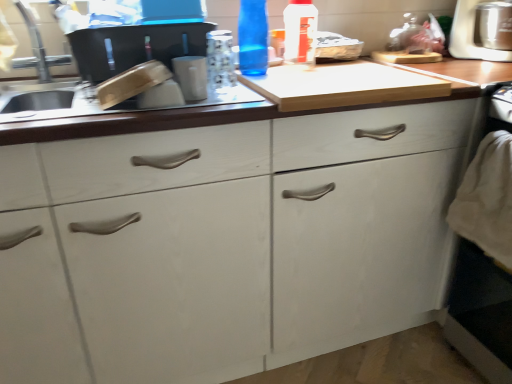
What is the approximate height of stainless steel food processor at upper right?

It is 8.36 inches.

The image size is (512, 384). What are the coordinates of `white matte cabinet at center` in the screenshot? It's located at (x=224, y=244).

Where is `brushed metal faucet at upper left`? The image size is (512, 384). brushed metal faucet at upper left is located at coordinates (37, 48).

From a real-world perspective, which object rests below the other?

white matte cabinet at center, from a real-world perspective.

Relative to blue glass bottle at upper center, arranged as the second bottle when viewed from the right, is white matte cabinet at center in front or behind?

Clearly, white matte cabinet at center is in front of blue glass bottle at upper center, arranged as the second bottle when viewed from the right.

Based on their positions, is white matte cabinet at center located to the left or right of blue glass bottle at upper center, the 1th bottle when ordered from left to right?

white matte cabinet at center is to the right of blue glass bottle at upper center, the 1th bottle when ordered from left to right.

Locate an element on the screen. bottle that is on the left side of white matte cabinet at center is located at coordinates (253, 37).

Is transparent plastic bottle at upper center, which is counted as the 2th bottle, starting from the left, taller or shorter than brushed metal faucet at upper left?

In the image, transparent plastic bottle at upper center, which is counted as the 2th bottle, starting from the left, appears to be shorter than brushed metal faucet at upper left.

Visually, is transparent plastic bottle at upper center, which is counted as the 2th bottle, starting from the left, positioned to the left or to the right of brushed metal faucet at upper left?

Based on their positions, transparent plastic bottle at upper center, which is counted as the 2th bottle, starting from the left, is located to the right of brushed metal faucet at upper left.

From a real-world perspective, which object rests below the other?

brushed metal faucet at upper left is physically lower.

Is transparent plastic bottle at upper center, which is counted as the 2th bottle, starting from the left, further to camera compared to brushed metal faucet at upper left?

Yes, transparent plastic bottle at upper center, which is counted as the 2th bottle, starting from the left, is behind brushed metal faucet at upper left.

Would you say blue glass bottle at upper center, arranged as the second bottle when viewed from the right, is outside white matte cabinet at center?

Yes, blue glass bottle at upper center, arranged as the second bottle when viewed from the right, is outside of white matte cabinet at center.

From the picture: Does blue glass bottle at upper center, the 1th bottle when ordered from left to right, lie behind white matte cabinet at center?

Yes, it is behind white matte cabinet at center.

From the image's perspective, is blue glass bottle at upper center, arranged as the second bottle when viewed from the right, located above or below white matte cabinet at center?

From the image's perspective, blue glass bottle at upper center, arranged as the second bottle when viewed from the right, appears above white matte cabinet at center.

Can you confirm if blue glass bottle at upper center, arranged as the second bottle when viewed from the right, is smaller than white matte cabinet at center?

Yes.

Is white matte cabinet at center shorter than transparent plastic bottle at upper center, marked as the 1th bottle in a right-to-left arrangement?

Incorrect, the height of white matte cabinet at center does not fall short of that of transparent plastic bottle at upper center, marked as the 1th bottle in a right-to-left arrangement.

From the picture: Would you say white matte cabinet at center is a long distance from transparent plastic bottle at upper center, marked as the 1th bottle in a right-to-left arrangement?

white matte cabinet at center is actually quite close to transparent plastic bottle at upper center, marked as the 1th bottle in a right-to-left arrangement.

In terms of size, does white matte cabinet at center appear bigger or smaller than transparent plastic bottle at upper center, which is counted as the 2th bottle, starting from the left?

In the image, white matte cabinet at center appears to be larger than transparent plastic bottle at upper center, which is counted as the 2th bottle, starting from the left.

From a real-world perspective, which is physically above, white matte cabinet at center or transparent plastic bottle at upper center, which is counted as the 2th bottle, starting from the left?

From a 3D spatial view, transparent plastic bottle at upper center, which is counted as the 2th bottle, starting from the left, is above.

Would you say brushed metal faucet at upper left is outside white matte cabinet at center?

Yes.

In the scene shown: Can you confirm if brushed metal faucet at upper left is taller than white matte cabinet at center?

No, brushed metal faucet at upper left is not taller than white matte cabinet at center.

From a real-world perspective, which is physically above, brushed metal faucet at upper left or white matte cabinet at center?

brushed metal faucet at upper left, from a real-world perspective.

Identify the location of faucet located on the left of white matte cabinet at center. (37, 48).

What's the angular difference between stainless steel food processor at upper right and brushed metal faucet at upper left's facing directions?

The angle between the facing direction of stainless steel food processor at upper right and the facing direction of brushed metal faucet at upper left is 4.9e-05 degrees.

From a real-world perspective, is stainless steel food processor at upper right positioned above or below brushed metal faucet at upper left?

stainless steel food processor at upper right is below brushed metal faucet at upper left.

At what (x,y) coordinates should I click in order to perform the action: click on appliance lying behind the brushed metal faucet at upper left. Please return your answer as a coordinate pair (x, y). Looking at the image, I should click on (470, 36).

Does stainless steel food processor at upper right contain brushed metal faucet at upper left?

No, stainless steel food processor at upper right does not contain brushed metal faucet at upper left.

Based on their positions, is white matte cabinet at center located to the left or right of brushed metal faucet at upper left?

In the image, white matte cabinet at center appears on the right side of brushed metal faucet at upper left.

Which object is more forward, white matte cabinet at center or brushed metal faucet at upper left?

white matte cabinet at center is closer to the camera.

Does white matte cabinet at center have a lesser height compared to brushed metal faucet at upper left?

No.

Which object is wider, white matte cabinet at center or brushed metal faucet at upper left?

white matte cabinet at center is wider.

You are a GUI agent. You are given a task and a screenshot of the screen. Output one action in this format:
    pyautogui.click(x=<x>, y=<y>)
    Task: Click on the 1st bottle behind the white matte cabinet at center, counting from the anchor's position
    This screenshot has height=384, width=512.
    Given the screenshot: What is the action you would take?
    pyautogui.click(x=253, y=37)

Where is `faucet on the left of transparent plastic bottle at upper center, which is counted as the 2th bottle, starting from the left`? faucet on the left of transparent plastic bottle at upper center, which is counted as the 2th bottle, starting from the left is located at coordinates (37, 48).

Considering their positions, is brushed metal faucet at upper left positioned closer to white matte cabinet at center than blue glass bottle at upper center, the 1th bottle when ordered from left to right?

blue glass bottle at upper center, the 1th bottle when ordered from left to right, is positioned closer to the anchor white matte cabinet at center.

From the image, which object appears to be nearer to stainless steel food processor at upper right, transparent plastic bottle at upper center, which is counted as the 2th bottle, starting from the left, or brushed metal faucet at upper left?

The object closer to stainless steel food processor at upper right is transparent plastic bottle at upper center, which is counted as the 2th bottle, starting from the left.

From the image, which object appears to be farther from blue glass bottle at upper center, arranged as the second bottle when viewed from the right, white matte cabinet at center or stainless steel food processor at upper right?

stainless steel food processor at upper right lies further to blue glass bottle at upper center, arranged as the second bottle when viewed from the right, than the other object.

Considering their positions, is brushed metal faucet at upper left positioned further to stainless steel food processor at upper right than blue glass bottle at upper center, arranged as the second bottle when viewed from the right?

The object further to stainless steel food processor at upper right is brushed metal faucet at upper left.

Consider the image. Which object lies nearer to the anchor point blue glass bottle at upper center, arranged as the second bottle when viewed from the right, brushed metal faucet at upper left or white matte cabinet at center?

→ Among the two, white matte cabinet at center is located nearer to blue glass bottle at upper center, arranged as the second bottle when viewed from the right.

From the picture: Looking at the image, which one is located further to stainless steel food processor at upper right, transparent plastic bottle at upper center, which is counted as the 2th bottle, starting from the left, or blue glass bottle at upper center, arranged as the second bottle when viewed from the right?

blue glass bottle at upper center, arranged as the second bottle when viewed from the right, is positioned further to the anchor stainless steel food processor at upper right.

Considering their positions, is blue glass bottle at upper center, the 1th bottle when ordered from left to right, positioned further to transparent plastic bottle at upper center, which is counted as the 2th bottle, starting from the left, than stainless steel food processor at upper right?

stainless steel food processor at upper right.

Based on their spatial positions, is stainless steel food processor at upper right or blue glass bottle at upper center, the 1th bottle when ordered from left to right, closer to white matte cabinet at center?

blue glass bottle at upper center, the 1th bottle when ordered from left to right.

The height and width of the screenshot is (384, 512). Identify the location of bottle between transparent plastic bottle at upper center, which is counted as the 2th bottle, starting from the left, and white matte cabinet at center, in the vertical direction. pyautogui.click(x=253, y=37).

Where is `bottle situated between white matte cabinet at center and stainless steel food processor at upper right from left to right`? The image size is (512, 384). bottle situated between white matte cabinet at center and stainless steel food processor at upper right from left to right is located at coordinates (300, 32).

Locate an element on the screen. The image size is (512, 384). cabinetry between brushed metal faucet at upper left and stainless steel food processor at upper right is located at coordinates (224, 244).

Identify the location of bottle situated between brushed metal faucet at upper left and white matte cabinet at center from left to right. This screenshot has width=512, height=384. (253, 37).